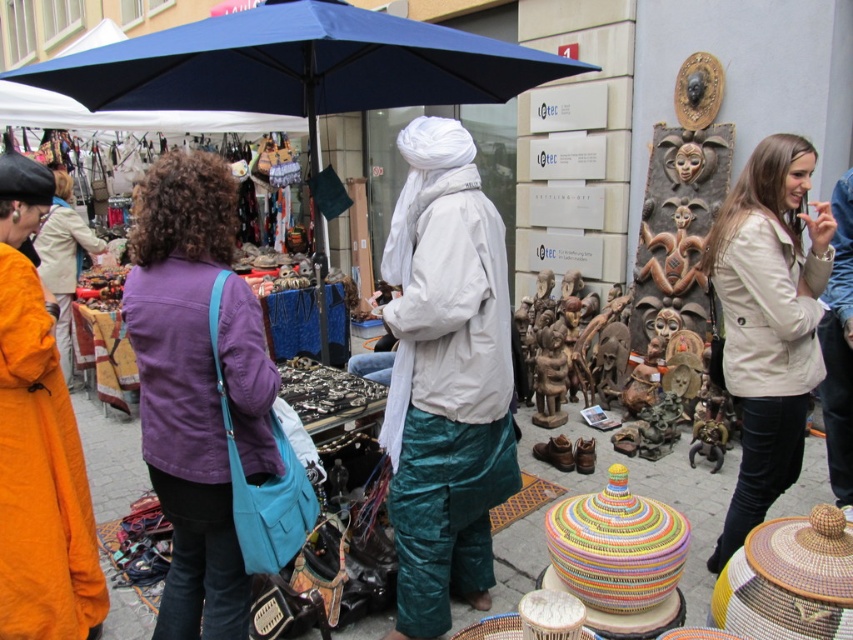
You are standing at the entrance of the market and see the point marked as point (769,321). What object is located at that point?

The beige leather jacket at upper right is located at point (769,321).

You are a photographer standing in the market and want to take a photo of the purple cotton jacket at center without the white satin turban at center blocking it. How should you adjust your position?

Move to a position where the purple cotton jacket at center is no longer behind the white satin turban at center. Since the purple cotton jacket at center is behind the white satin turban at center, moving sideways or changing your angle could allow you to capture the jacket without obstruction.